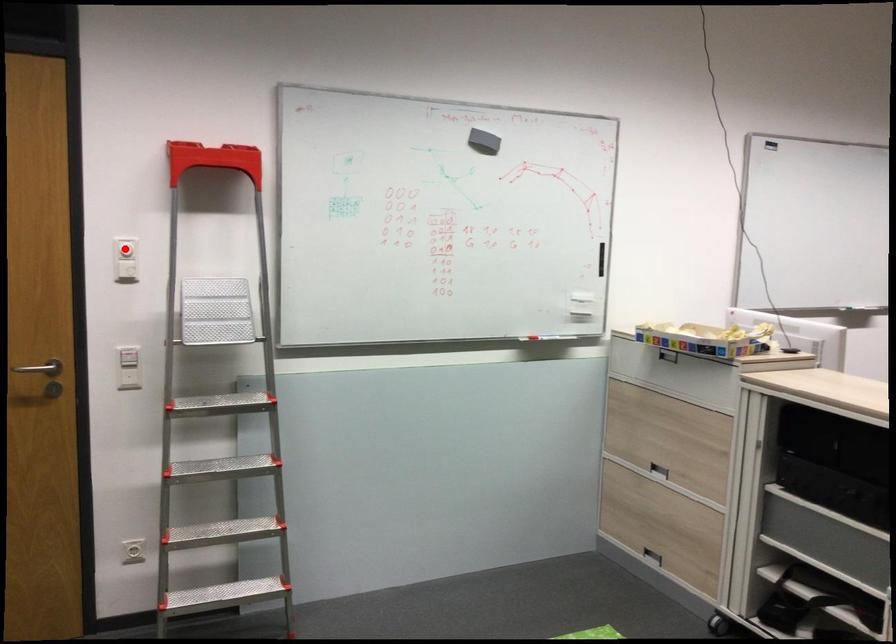
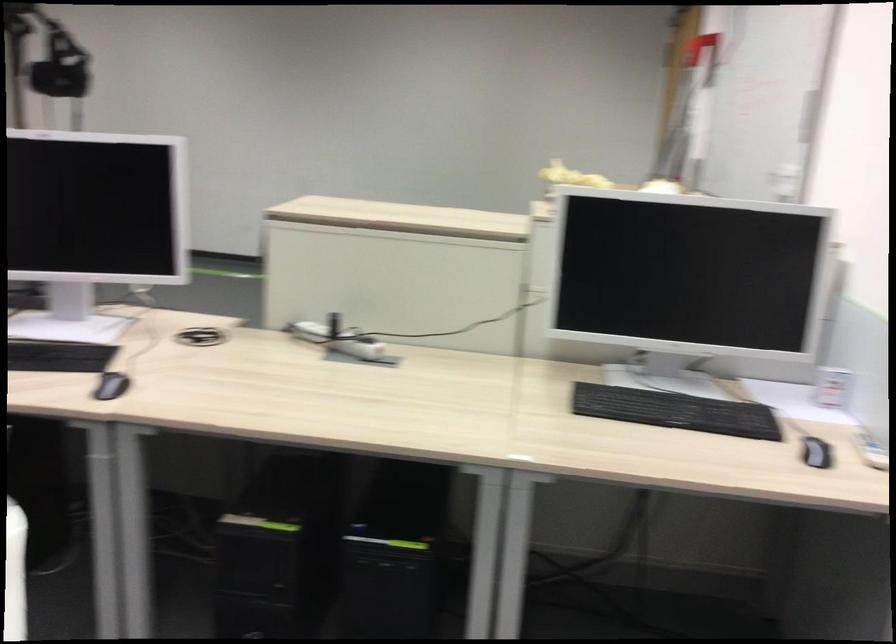
Question: I am providing you with two images of the same scene from different viewpoints. A red point is marked on the first image. Can you still see the location of the red point in image 2?

Choices:
 (A) Yes
 (B) No

Answer: (B)